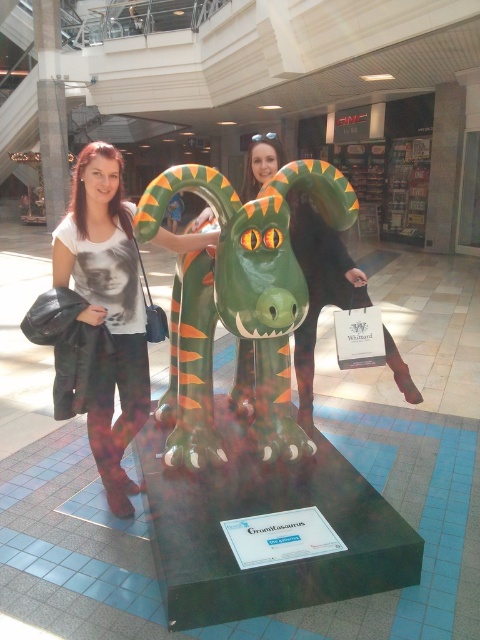
Question: Which point is closer to the camera?

Choices:
 (A) matte white t-shirt at center
 (B) green rubber dragon at center

Answer: (B)

Question: Does green rubber dragon at center appear on the left side of matte white t-shirt at center?

Choices:
 (A) yes
 (B) no

Answer: (B)

Question: Is green rubber dragon at center thinner than matte white t-shirt at center?

Choices:
 (A) no
 (B) yes

Answer: (A)

Question: Can you confirm if green rubber dragon at center is positioned to the left of matte white t-shirt at center?

Choices:
 (A) no
 (B) yes

Answer: (A)